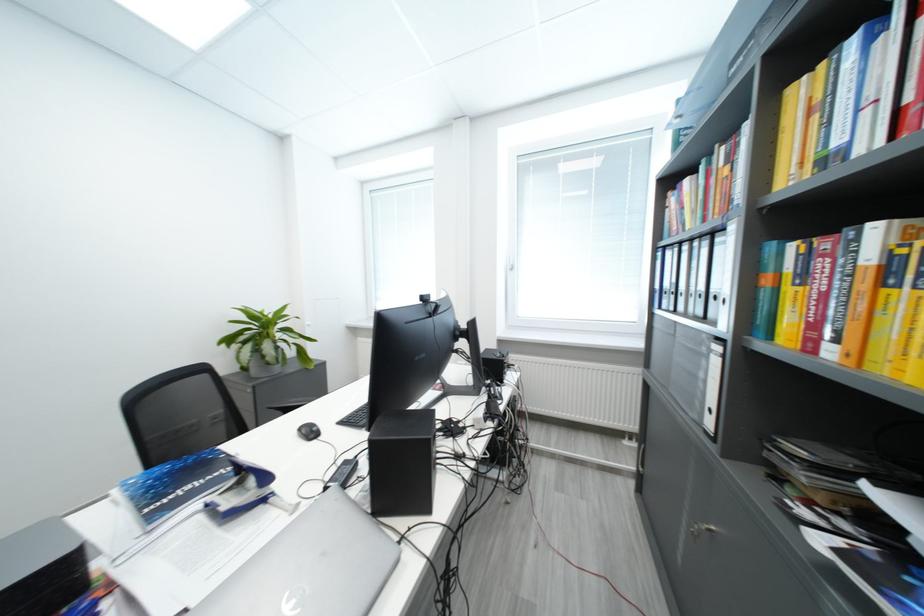
The location [310,565] corresponds to which object?

It refers to a silver laptop.